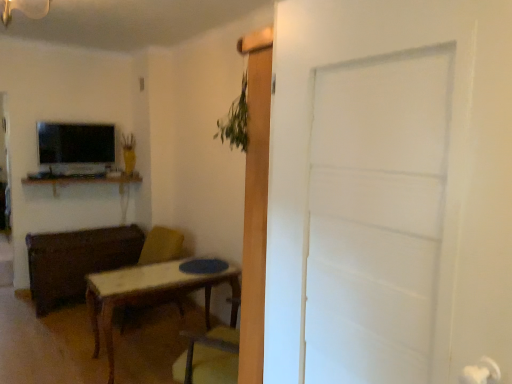
Find the location of a particular element. Image resolution: width=512 pixels, height=384 pixels. matte wood chest at left is located at coordinates (76, 261).

The width and height of the screenshot is (512, 384). Describe the element at coordinates (76, 147) in the screenshot. I see `matte black tv at upper left` at that location.

Identify the location of matte wood chest at left. Image resolution: width=512 pixels, height=384 pixels. (76, 261).

Does matte black tv at upper left turn towards white matte door at center?

Yes, matte black tv at upper left is turned towards white matte door at center.

Consider the image. Is matte black tv at upper left thinner than white matte door at center?

Incorrect, the width of matte black tv at upper left is not less than that of white matte door at center.

How much distance is there between matte black tv at upper left and white matte door at center?

matte black tv at upper left and white matte door at center are 11.89 feet apart.

Who is smaller, matte black tv at upper left or white matte door at center?

With smaller size is matte black tv at upper left.

Is wooden desk at upper left wider than matte wood chest at left?

No.

Is wooden desk at upper left touching matte wood chest at left?

wooden desk at upper left and matte wood chest at left are not in contact.

Is wooden desk at upper left facing away from matte wood chest at left?

No, wooden desk at upper left's orientation is not away from matte wood chest at left.

Is wooden swivel chair at center facing towards matte black tv at upper left?

No, wooden swivel chair at center is not aimed at matte black tv at upper left.

From the image's perspective, is wooden swivel chair at center located above or below matte black tv at upper left?

wooden swivel chair at center is situated lower than matte black tv at upper left in the image.

Does point (137, 320) come behind point (102, 142)?

No, (137, 320) is closer to viewer.

From a real-world perspective, is wooden swivel chair at center below matte black tv at upper left?

Yes, from a real-world perspective, wooden swivel chair at center is beneath matte black tv at upper left.

Is matte wood chest at left in front of white matte door at center?

No, matte wood chest at left is further to the viewer.

In terms of width, does matte wood chest at left look wider or thinner when compared to white matte door at center?

Clearly, matte wood chest at left has more width compared to white matte door at center.

Does point (39, 262) appear closer or farther from the camera than point (302, 180)?

Clearly, point (39, 262) is more distant from the camera than point (302, 180).

At what (x,y) coordinates should I click in order to perform the action: click on television above the wooden swivel chair at center (from a real-world perspective). Please return your answer as a coordinate pair (x, y). Looking at the image, I should click on (76, 147).

Looking at their sizes, would you say matte black tv at upper left is wider or thinner than wooden swivel chair at center?

Considering their sizes, matte black tv at upper left looks slimmer than wooden swivel chair at center.

Who is taller, matte black tv at upper left or wooden swivel chair at center?

With more height is wooden swivel chair at center.

Choose the correct answer: Is matte black tv at upper left inside wooden swivel chair at center or outside it?

matte black tv at upper left is spatially situated outside wooden swivel chair at center.

Is white matte door at center bigger than wooden swivel chair at center?

No.

Which is nearer, [400,325] or [150,259]?

Positioned in front is point [400,325].

Considering the sizes of objects white matte door at center and wooden swivel chair at center in the image provided, who is shorter, white matte door at center or wooden swivel chair at center?

With less height is wooden swivel chair at center.

Consider the image. Can you confirm if white matte door at center is thinner than wooden swivel chair at center?

Yes.

Which is in front, point (328, 122) or point (53, 128)?

Point (328, 122)

What's the angular difference between white matte door at center and matte black tv at upper left's facing directions?

white matte door at center and matte black tv at upper left are facing 87.3 degrees away from each other.

Considering the sizes of white matte door at center and matte black tv at upper left in the image, is white matte door at center bigger or smaller than matte black tv at upper left?

Clearly, white matte door at center is larger in size than matte black tv at upper left.

You are a GUI agent. You are given a task and a screenshot of the screen. Output one action in this format:
    pyautogui.click(x=<x>, y=<y>)
    Task: Click on the door on the right of the matte black tv at upper left
    
    Given the screenshot: What is the action you would take?
    pyautogui.click(x=389, y=191)

Identify the location of brown that is below the wooden desk at upper left (from the image's perspective). (76, 261).

Looking at the image, which one is located further to matte wood chest at left, wooden swivel chair at center or wooden desk at upper left?

The object further to matte wood chest at left is wooden desk at upper left.

Considering their positions, is matte wood chest at left positioned closer to white matte door at center than wooden swivel chair at center?

wooden swivel chair at center is positioned closer to the anchor white matte door at center.

From the image, which object appears to be nearer to matte black tv at upper left, matte wood chest at left or wooden desk at upper left?

wooden desk at upper left lies closer to matte black tv at upper left than the other object.

Considering their positions, is matte wood chest at left positioned closer to wooden swivel chair at center than wooden desk at upper left?

matte wood chest at left is positioned closer to the anchor wooden swivel chair at center.

Which object lies further to the anchor point wooden desk at upper left, wooden swivel chair at center or matte wood chest at left?

Among the two, wooden swivel chair at center is located further to wooden desk at upper left.

Estimate the real-world distances between objects in this image. Which object is further from white matte door at center, wooden desk at upper left or matte black tv at upper left?

The object further to white matte door at center is wooden desk at upper left.

Based on their spatial positions, is matte black tv at upper left or white matte door at center closer to matte wood chest at left?

Among the two, matte black tv at upper left is located nearer to matte wood chest at left.

From the image, which object appears to be farther from matte wood chest at left, wooden desk at upper left or matte black tv at upper left?

matte black tv at upper left is positioned further to the anchor matte wood chest at left.

You are a GUI agent. You are given a task and a screenshot of the screen. Output one action in this format:
    pyautogui.click(x=<x>, y=<y>)
    Task: Click on the brown between white matte door at center and wooden desk at upper left in the front-back direction
    This screenshot has height=384, width=512.
    Given the screenshot: What is the action you would take?
    pyautogui.click(x=76, y=261)

Locate an element on the screen. Image resolution: width=512 pixels, height=384 pixels. computer desk located between white matte door at center and matte black tv at upper left in the depth direction is located at coordinates (85, 180).

Find the location of a particular element. This screenshot has height=384, width=512. brown between matte black tv at upper left and wooden swivel chair at center vertically is located at coordinates (76, 261).

You are a GUI agent. You are given a task and a screenshot of the screen. Output one action in this format:
    pyautogui.click(x=<x>, y=<y>)
    Task: Click on the computer desk between matte black tv at upper left and wooden swivel chair at center from top to bottom
    The image size is (512, 384).
    Given the screenshot: What is the action you would take?
    pyautogui.click(x=85, y=180)